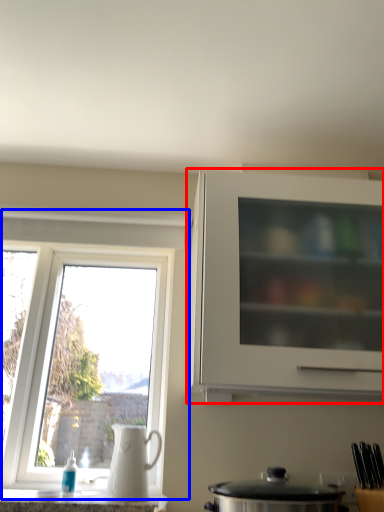
Question: Which of the following is the farthest to the observer, cabinetry (highlighted by a red box) or window (highlighted by a blue box)?

Choices:
 (A) cabinetry
 (B) window

Answer: (B)